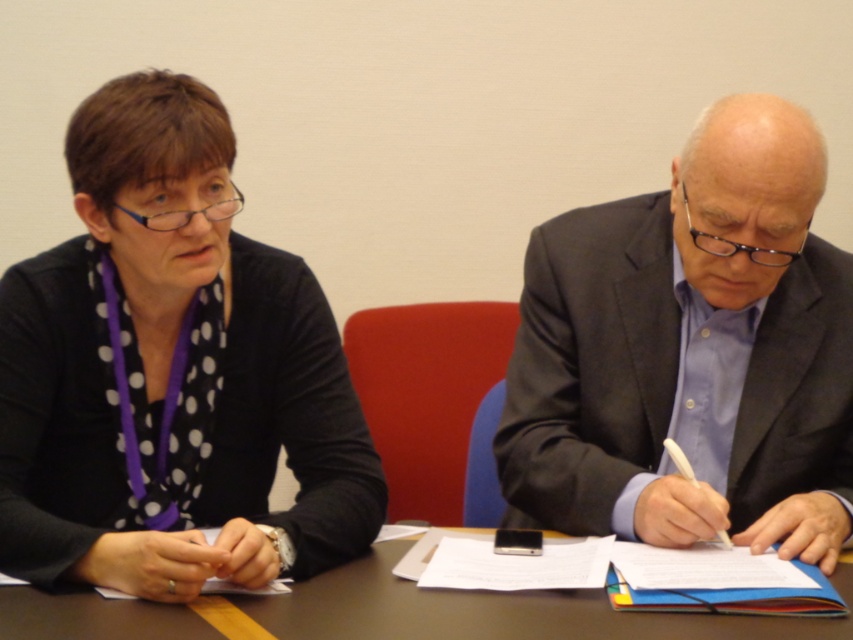
Question: Which object is farther from the camera taking this photo?

Choices:
 (A) brown wooden table at center
 (B) polka dot fabric at left

Answer: (B)

Question: Is polka dot fabric at left further to the viewer compared to brown wooden table at center?

Choices:
 (A) yes
 (B) no

Answer: (A)

Question: Which point appears farthest from the camera in this image?

Choices:
 (A) (651, 230)
 (B) (155, 611)

Answer: (A)

Question: Considering the relative positions of polka dot fabric at left and matte black suit at right in the image provided, where is polka dot fabric at left located with respect to matte black suit at right?

Choices:
 (A) above
 (B) below

Answer: (A)

Question: Can you confirm if polka dot fabric at left is positioned to the right of matte black suit at right?

Choices:
 (A) no
 (B) yes

Answer: (A)

Question: Based on their relative distances, which object is farther from the matte black suit at right?

Choices:
 (A) polka dot fabric at left
 (B) brown wooden table at center

Answer: (A)